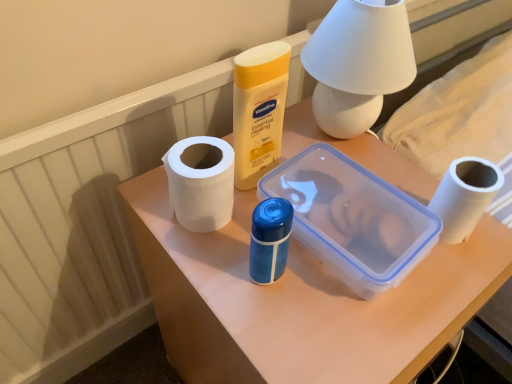
From the picture: Measure the distance between point (190, 142) and camera.

They are 21.34 inches apart.

Describe the element at coordinates (87, 222) in the screenshot. I see `white textured radiator at lower left` at that location.

Locate an element on the screen. Image resolution: width=512 pixels, height=384 pixels. white textured radiator at lower left is located at coordinates (87, 222).

The height and width of the screenshot is (384, 512). Find the location of `white matte table lamp at upper center`. white matte table lamp at upper center is located at coordinates (358, 63).

The height and width of the screenshot is (384, 512). I want to click on white matte paper towel at center-left, so click(x=201, y=182).

Find the location of `paper towel to the left of white matte table lamp at upper center`. paper towel to the left of white matte table lamp at upper center is located at coordinates (201, 182).

From a real-world perspective, is white matte table lamp at upper center above or below white matte paper towel at center-left?

white matte table lamp at upper center is above white matte paper towel at center-left.

Is white matte table lamp at upper center taller than white matte paper towel at center-left?

Correct, white matte table lamp at upper center is much taller as white matte paper towel at center-left.

Choose the correct answer: Is white matte table lamp at upper center inside white matte paper towel at center-left or outside it?

white matte table lamp at upper center exists outside the volume of white matte paper towel at center-left.

You are a GUI agent. You are given a task and a screenshot of the screen. Output one action in this format:
    pyautogui.click(x=<x>, y=<y>)
    Task: Click on the toilet paper behind the white matte table lamp at upper center
    
    Given the screenshot: What is the action you would take?
    [465, 196]

Which of these two, white matte table lamp at upper center or white matte toilet paper at right, is thinner?

With smaller width is white matte toilet paper at right.

Does white matte table lamp at upper center appear on the right side of white matte toilet paper at right?

In fact, white matte table lamp at upper center is to the left of white matte toilet paper at right.

Can white matte toilet paper at right be found inside white matte table lamp at upper center?

No, white matte toilet paper at right is not inside white matte table lamp at upper center.

Is white textured radiator at lower left inside the boundaries of white matte plastic container at center, or outside?

white textured radiator at lower left is not inside white matte plastic container at center, it's outside.

Is the position of white textured radiator at lower left less distant than that of white matte plastic container at center?

That is False.

Which of these two, white textured radiator at lower left or white matte plastic container at center, stands taller?

Standing taller between the two is white textured radiator at lower left.

Which is in front, point (104, 327) or point (244, 280)?

The point (244, 280) is more forward.

Considering the positions of point (42, 355) and point (225, 204), is point (42, 355) closer or farther from the camera than point (225, 204)?

Point (42, 355) appears to be farther away from the viewer than point (225, 204).

Is white textured radiator at lower left closer to camera compared to white matte paper towel at center-left?

Yes, white textured radiator at lower left is closer to the camera.

Is white textured radiator at lower left looking in the opposite direction of white matte paper towel at center-left?

white textured radiator at lower left is not turned away from white matte paper towel at center-left.

Does white matte toilet paper at right have a lesser width compared to white matte plastic container at center?

Correct, the width of white matte toilet paper at right is less than that of white matte plastic container at center.

Which object is further away from the camera taking this photo, white matte toilet paper at right or white matte plastic container at center?

white matte toilet paper at right is further from the camera.

What are the coordinates of `table below the white matte toilet paper at right (from the image's perspective)` in the screenshot? It's located at (298, 301).

Based on the photo, from a real-world perspective, is white matte toilet paper at right located beneath white matte plastic container at center?

No, from a real-world perspective, white matte toilet paper at right is not below white matte plastic container at center.

Between white matte toilet paper at right and white matte table lamp at upper center, which one has larger size?

white matte table lamp at upper center is bigger.

Which object is positioned more to the right, white matte toilet paper at right or white matte table lamp at upper center?

From the viewer's perspective, white matte toilet paper at right appears more on the right side.

Is white matte toilet paper at right further to the viewer compared to white matte table lamp at upper center?

Yes, it is behind white matte table lamp at upper center.

Visually, is white matte plastic container at center positioned to the left or to the right of white textured radiator at lower left?

From the image, it's evident that white matte plastic container at center is to the right of white textured radiator at lower left.

Which point is more distant from viewer, (293,145) or (208,113)?

The point (208,113) is behind.

How different are the orientations of white matte plastic container at center and white textured radiator at lower left in degrees?

1.44 degrees.

Find the location of `table lamp in front of the white matte paper towel at center-left`. table lamp in front of the white matte paper towel at center-left is located at coordinates (358, 63).

Where is `toilet paper located below the white matte table lamp at upper center (from the image's perspective)`? The height and width of the screenshot is (384, 512). toilet paper located below the white matte table lamp at upper center (from the image's perspective) is located at coordinates (465, 196).

Looking at the image, which one is located closer to white matte plastic container at center, white matte toilet paper at right or white matte paper towel at center-left?

white matte paper towel at center-left.

Estimate the real-world distances between objects in this image. Which object is further from white matte plastic container at center, white matte table lamp at upper center or white matte toilet paper at right?

white matte table lamp at upper center lies further to white matte plastic container at center than the other object.

Looking at the image, which one is located further to white matte paper towel at center-left, white matte table lamp at upper center or white matte plastic container at center?

white matte table lamp at upper center lies further to white matte paper towel at center-left than the other object.

From the image, which object appears to be farther from white textured radiator at lower left, white matte plastic container at center or white matte toilet paper at right?

white matte toilet paper at right is positioned further to the anchor white textured radiator at lower left.

Consider the image. Estimate the real-world distances between objects in this image. Which object is further from white matte paper towel at center-left, white matte toilet paper at right or white matte plastic container at center?

white matte toilet paper at right.

Considering their positions, is white textured radiator at lower left positioned closer to white matte table lamp at upper center than white matte toilet paper at right?

white matte toilet paper at right is closer to white matte table lamp at upper center.

Looking at the image, which one is located closer to white matte plastic container at center, white matte table lamp at upper center or white textured radiator at lower left?

white matte table lamp at upper center is closer to white matte plastic container at center.

Which object lies further to the anchor point white matte table lamp at upper center, white matte plastic container at center or white textured radiator at lower left?

The object further to white matte table lamp at upper center is white textured radiator at lower left.

Locate an element on the screen. radiator between white matte paper towel at center-left and white matte toilet paper at right from left to right is located at coordinates (87, 222).

Where is `radiator between white matte paper towel at center-left and white matte table lamp at upper center from left to right`? radiator between white matte paper towel at center-left and white matte table lamp at upper center from left to right is located at coordinates (87, 222).

Identify the location of paper towel that lies between white matte table lamp at upper center and white matte plastic container at center from top to bottom. (201, 182).

Identify the location of radiator between white matte table lamp at upper center and white matte plastic container at center in the up-down direction. (87, 222).